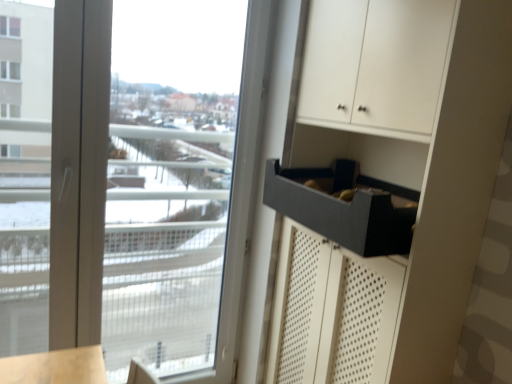
Question: Is transparent glass window at upper left taller than matte black drawer at right?

Choices:
 (A) yes
 (B) no

Answer: (A)

Question: Is transparent glass window at upper left to the right of matte black drawer at right from the viewer's perspective?

Choices:
 (A) yes
 (B) no

Answer: (B)

Question: Can you see transparent glass window at upper left touching matte black drawer at right?

Choices:
 (A) yes
 (B) no

Answer: (B)

Question: Is transparent glass window at upper left shorter than matte black drawer at right?

Choices:
 (A) yes
 (B) no

Answer: (B)

Question: From the image's perspective, is transparent glass window at upper left under matte black drawer at right?

Choices:
 (A) yes
 (B) no

Answer: (B)

Question: Is transparent glass window at upper left inside the boundaries of matte gray drawer at lower right, or outside?

Choices:
 (A) outside
 (B) inside

Answer: (A)

Question: From a real-world perspective, is transparent glass window at upper left positioned above or below matte gray drawer at lower right?

Choices:
 (A) above
 (B) below

Answer: (B)

Question: In terms of width, does transparent glass window at upper left look wider or thinner when compared to matte gray drawer at lower right?

Choices:
 (A) wide
 (B) thin

Answer: (B)

Question: Relative to matte gray drawer at lower right, is transparent glass window at upper left in front or behind?

Choices:
 (A) front
 (B) behind

Answer: (B)

Question: In the image, is transparent glass window at upper left on the left side or the right side of matte black drawer at right?

Choices:
 (A) left
 (B) right

Answer: (A)

Question: Based on their sizes in the image, would you say transparent glass window at upper left is bigger or smaller than matte black drawer at right?

Choices:
 (A) big
 (B) small

Answer: (B)

Question: From a real-world perspective, is transparent glass window at upper left above or below matte black drawer at right?

Choices:
 (A) below
 (B) above

Answer: (A)

Question: Relative to matte black drawer at right, is transparent glass window at upper left in front or behind?

Choices:
 (A) front
 (B) behind

Answer: (B)

Question: Relative to matte gray drawer at lower right, is matte black drawer at right in front or behind?

Choices:
 (A) front
 (B) behind

Answer: (A)

Question: From a real-world perspective, is matte black drawer at right above or below matte gray drawer at lower right?

Choices:
 (A) above
 (B) below

Answer: (B)